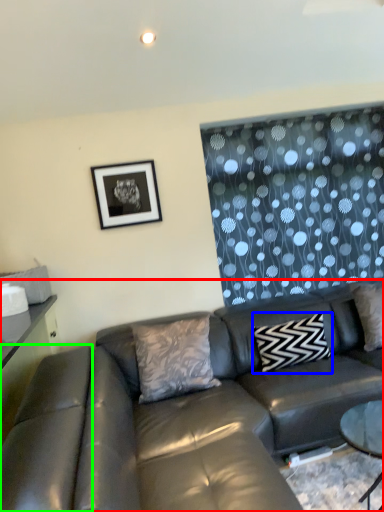
Question: Estimate the real-world distances between objects in this image. Which object is farther from studio couch (highlighted by a red box), pillow (highlighted by a blue box) or swivel chair (highlighted by a green box)?

Choices:
 (A) pillow
 (B) swivel chair

Answer: (A)